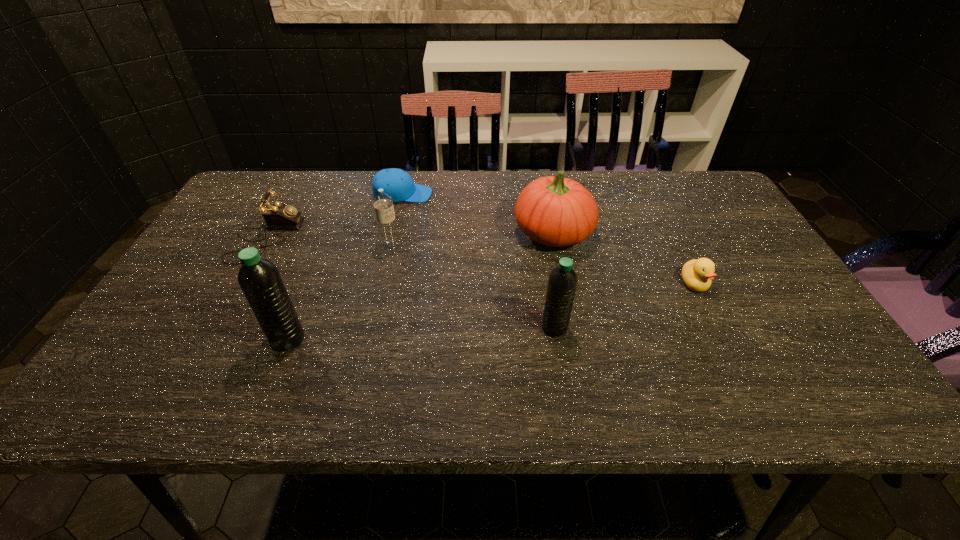
At what (x,y) coordinates should I click in order to perform the action: click on vacant area in the image that satisfies the following two spatial constraints: 1. on the front-facing side of the farthest object; 2. on the back side of the pumpkin. Please return your answer as a coordinate pair (x, y). This screenshot has height=540, width=960. Looking at the image, I should click on (395, 233).